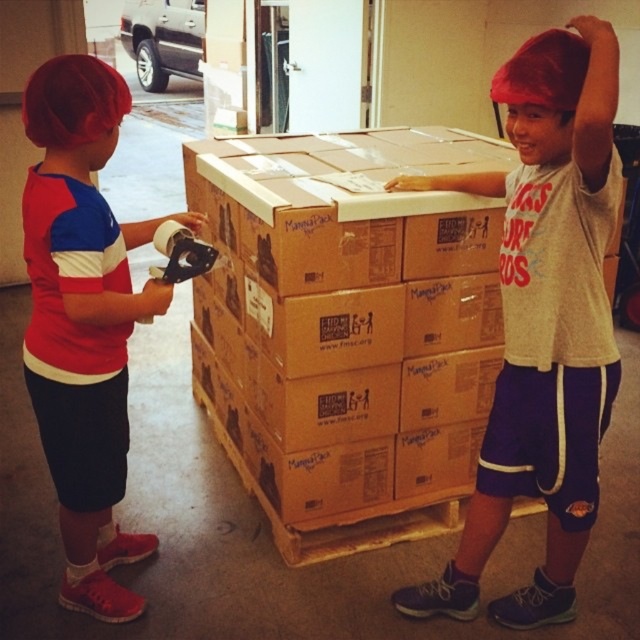
Based on the photo, you are a photographer setting up a photo shoot in this warehouse scene. You need to ensure that the matte gray shirt at center and the matte red hair at left are both visible in the frame. Based on their widths, which object should you position closer to the edge of the frame to avoid overcrowding?

The matte gray shirt at center is wider than the matte red hair at left, so positioning the matte gray shirt at center closer to the edge of the frame would help prevent overcrowding due to its greater width.

You are a photographer trying to capture a photo of the two children in the scene. You need to ensure that both the matte gray shirt at center and the matte red hair at left are clearly visible in the frame. Given their relative sizes, which object should you focus on first to ensure proper focus and depth of field?

The matte gray shirt at center has a greater height compared to the matte red hair at left, so you should focus on the matte gray shirt at center first to ensure proper focus and depth of field.

You are a photographer setting up a shoot in this warehouse. You need to place a light source so that it illuminates both the matte gray shirt at center and the matte red hair at left without causing harsh shadows. Considering their sizes, which object should be closer to the light source to ensure even lighting?

The matte red hair at left is smaller than the matte gray shirt at center. To achieve even lighting, the matte red hair at left should be placed closer to the light source since it is smaller and requires less light to be adequately illuminated compared to the larger matte gray shirt at center.